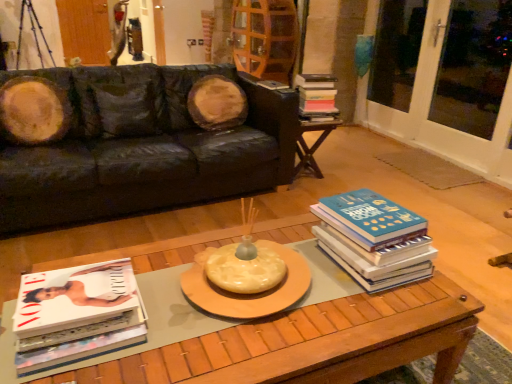
Find the location of a particular element. blank area beneath hardcover book at center, which is the first book from top to bottom (from a real-world perspective) is located at coordinates (317, 127).